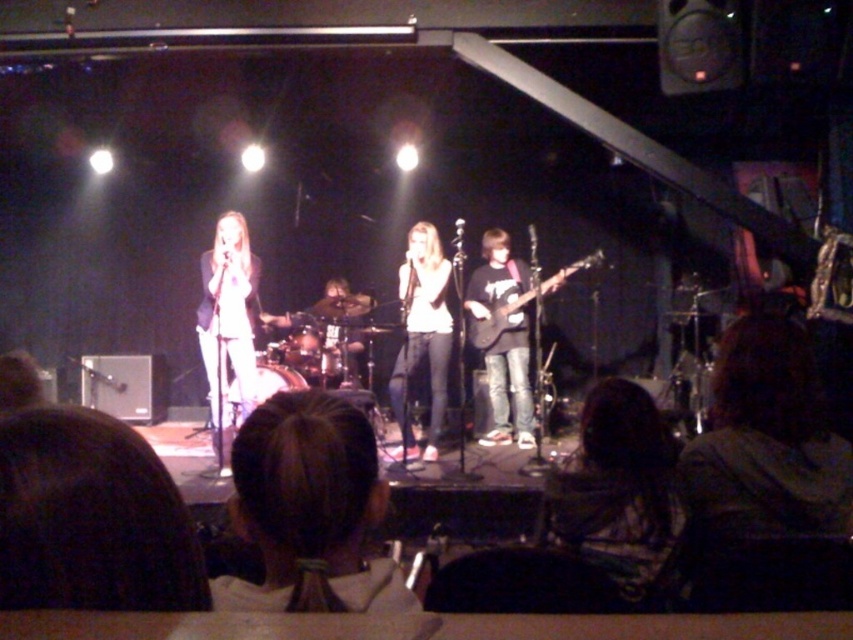
Question: Among these objects, which one is nearest to the camera?

Choices:
 (A) shiny silver drum set at center
 (B) brown hair at center
 (C) matte black electric guitar at center

Answer: (B)

Question: Considering the relative positions of brown hair at center and white matte shirt at center in the image provided, where is brown hair at center located with respect to white matte shirt at center?

Choices:
 (A) left
 (B) right

Answer: (A)

Question: Is brown hair at center to the left of white matte shirt at center from the viewer's perspective?

Choices:
 (A) yes
 (B) no

Answer: (A)

Question: Does black matte guitar at center lie in front of shiny silver drum set at center?

Choices:
 (A) yes
 (B) no

Answer: (A)

Question: Which point appears closest to the camera in this image?

Choices:
 (A) (555, 282)
 (B) (323, 365)
 (C) (440, 339)
 (D) (590, 262)

Answer: (C)

Question: Which object is closer to the camera taking this photo?

Choices:
 (A) shiny silver drum set at center
 (B) brown hair at center
 (C) white matte shirt at center

Answer: (B)